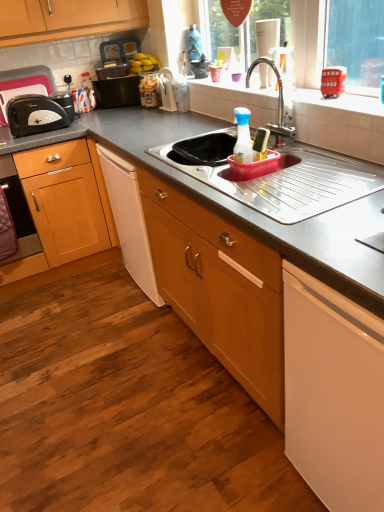
This screenshot has width=384, height=512. Describe the element at coordinates (278, 102) in the screenshot. I see `silver metallic faucet at upper center` at that location.

Measure the distance between yellow matte bananas at upper center and camera.

yellow matte bananas at upper center and camera are 8.42 feet apart from each other.

What do you see at coordinates (144, 63) in the screenshot?
I see `yellow matte bananas at upper center` at bounding box center [144, 63].

The height and width of the screenshot is (512, 384). What are the coordinates of `stainless steel sink at center` in the screenshot? It's located at (292, 185).

Image resolution: width=384 pixels, height=512 pixels. Find the location of `white ceramic window sill at upper center`. white ceramic window sill at upper center is located at coordinates (235, 91).

Where is `matte black toaster at left`? matte black toaster at left is located at coordinates (35, 115).

Is white plastic bottle at sink at the left side of silver metallic faucet at upper center?

Indeed, white plastic bottle at sink is positioned on the left side of silver metallic faucet at upper center.

Is white plastic bottle at sink oriented away from silver metallic faucet at upper center?

No, white plastic bottle at sink is not facing the opposite direction of silver metallic faucet at upper center.

In the scene shown: Can you tell me how much white plastic bottle at sink and silver metallic faucet at upper center differ in facing direction?

The angle between the facing direction of white plastic bottle at sink and the facing direction of silver metallic faucet at upper center is 8.22 degrees.

Considering the points (209, 79) and (346, 413), which point is behind, point (209, 79) or point (346, 413)?

The point (209, 79) is farther.

Can we say white ceramic window sill at upper center lies outside white matte dishwasher at lower right?

white ceramic window sill at upper center is positioned outside white matte dishwasher at lower right.

Is white ceramic window sill at upper center aimed at white matte dishwasher at lower right?

No, white ceramic window sill at upper center is not aimed at white matte dishwasher at lower right.

Is stainless steel sink at center surrounding white plastic bottle at sink?

No, white plastic bottle at sink is not surrounded by stainless steel sink at center.

Does stainless steel sink at center have a greater width compared to white plastic bottle at sink?

Yes.

From the image's perspective, is stainless steel sink at center above or below white plastic bottle at sink?

stainless steel sink at center is situated lower than white plastic bottle at sink in the image.

Does stainless steel sink at center have a larger size compared to white plastic bottle at sink?

Yes.

Is stainless steel sink at center positioned far away from white matte dishwasher at lower right?

stainless steel sink at center is actually quite close to white matte dishwasher at lower right.

Between stainless steel sink at center and white matte dishwasher at lower right, which one has smaller size?

stainless steel sink at center.

Can you tell me how much stainless steel sink at center and white matte dishwasher at lower right differ in facing direction?

The angular difference between stainless steel sink at center and white matte dishwasher at lower right is 0.789 degrees.

From the image's perspective, is stainless steel sink at center located above or below white matte dishwasher at lower right?

stainless steel sink at center is above white matte dishwasher at lower right.

Find the location of a particular element. the 2nd appliance behind the white plastic bottle at sink, counting from the anchor's position is located at coordinates (24, 85).

Is black plastic toaster at left, which ranks as the 1th appliance in left-to-right order, oriented away from white plastic bottle at sink?

No, black plastic toaster at left, which ranks as the 1th appliance in left-to-right order, is not facing away from white plastic bottle at sink.

Does black plastic toaster at left, which ranks as the 1th appliance in left-to-right order, have a lesser height compared to white plastic bottle at sink?

In fact, black plastic toaster at left, which ranks as the 1th appliance in left-to-right order, may be taller than white plastic bottle at sink.

Is black plastic toaster at left, placed as the 2th appliance when sorted from right to left, situated inside white plastic bottle at sink or outside?

black plastic toaster at left, placed as the 2th appliance when sorted from right to left, is not enclosed by white plastic bottle at sink.

In the scene shown: Does white plastic dish rack at upper center, which appears as the second appliance when viewed from the left, come in front of white matte dishwasher at lower right?

No, the depth of white plastic dish rack at upper center, which appears as the second appliance when viewed from the left, is greater than that of white matte dishwasher at lower right.

Consider the image. From the image's perspective, is white plastic dish rack at upper center, which appears as the second appliance when viewed from the left, below white matte dishwasher at lower right?

Actually, white plastic dish rack at upper center, which appears as the second appliance when viewed from the left, appears above white matte dishwasher at lower right in the image.

Is white plastic dish rack at upper center, which appears as the second appliance when viewed from the left, taller than white matte dishwasher at lower right?

Incorrect, the height of white plastic dish rack at upper center, which appears as the second appliance when viewed from the left, is not larger of that of white matte dishwasher at lower right.

Which of these two, white matte dishwasher at lower right or white ceramic window sill at upper center, stands taller?

With more height is white matte dishwasher at lower right.

From a real-world perspective, does white matte dishwasher at lower right stand above white ceramic window sill at upper center?

No.

Does white matte dishwasher at lower right appear on the left side of white ceramic window sill at upper center?

No.

From the image's perspective, is white matte dishwasher at lower right over white ceramic window sill at upper center?

Actually, white matte dishwasher at lower right appears below white ceramic window sill at upper center in the image.

Identify the location of bottle below the silver metallic faucet at upper center (from the image's perspective). (243, 136).

This screenshot has height=512, width=384. I want to click on cabinetry in front of the white ceramic window sill at upper center, so click(x=333, y=393).

Based on their spatial positions, is white matte dishwasher at lower right or yellow matte bananas at upper center closer to silver metallic faucet at upper center?

yellow matte bananas at upper center lies closer to silver metallic faucet at upper center than the other object.

Estimate the real-world distances between objects in this image. Which object is further from silver metallic faucet at upper center, white matte dishwasher at lower right or matte black toaster at left?

matte black toaster at left is further to silver metallic faucet at upper center.

Estimate the real-world distances between objects in this image. Which object is closer to silver metallic faucet at upper center, black plastic toaster at left, which ranks as the 1th appliance in left-to-right order, or white ceramic window sill at upper center?

white ceramic window sill at upper center.

Which object lies nearer to the anchor point silver metallic faucet at upper center, white plastic dish rack at upper center, which appears as the second appliance when viewed from the left, or white ceramic window sill at upper center?

The object closer to silver metallic faucet at upper center is white ceramic window sill at upper center.

Estimate the real-world distances between objects in this image. Which object is closer to yellow matte bananas at upper center, stainless steel sink at center or white ceramic window sill at upper center?

The object closer to yellow matte bananas at upper center is white ceramic window sill at upper center.

When comparing their distances from silver metallic faucet at upper center, does white plastic dish rack at upper center, which appears as the second appliance when viewed from the left, or matte black toaster at left seem further?

Among the two, matte black toaster at left is located further to silver metallic faucet at upper center.

Looking at the image, which one is located closer to black plastic toaster at left, placed as the 2th appliance when sorted from right to left, matte black toaster at left or white plastic bottle at sink?

matte black toaster at left is closer to black plastic toaster at left, placed as the 2th appliance when sorted from right to left.

Which object lies further to the anchor point white plastic bottle at sink, white matte dishwasher at lower right or matte black toaster at left?

matte black toaster at left is further to white plastic bottle at sink.

Locate an element on the screen. The height and width of the screenshot is (512, 384). window sill positioned between white matte dishwasher at lower right and white plastic dish rack at upper center, which appears as the second appliance when viewed from the left, from near to far is located at coordinates (235, 91).

Locate an element on the screen. The width and height of the screenshot is (384, 512). tap between matte black toaster at left and white matte dishwasher at lower right is located at coordinates (278, 102).

What are the coordinates of `sink between matte black toaster at left and white ceramic window sill at upper center from left to right` in the screenshot? It's located at (292, 185).

You are a GUI agent. You are given a task and a screenshot of the screen. Output one action in this format:
    pyautogui.click(x=<x>, y=<y>)
    Task: Click on the bottle between white ceramic window sill at upper center and yellow matte bananas at upper center along the z-axis
    
    Given the screenshot: What is the action you would take?
    pyautogui.click(x=243, y=136)